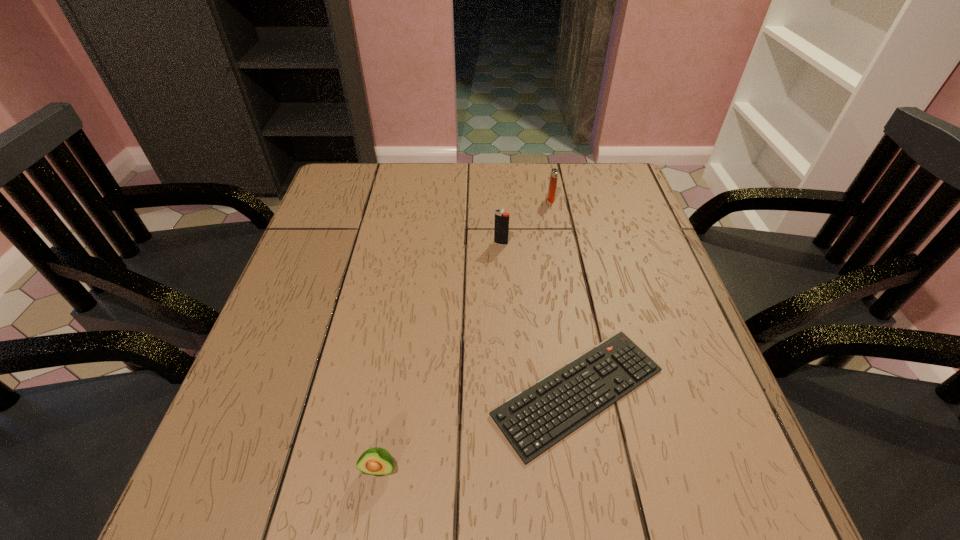
Locate an element on the screen. the nearer igniter is located at coordinates (501, 228).

Where is `the left igniter`? Image resolution: width=960 pixels, height=540 pixels. the left igniter is located at coordinates (501, 228).

This screenshot has width=960, height=540. I want to click on the farther igniter, so [554, 172].

Where is `the right igniter`? Image resolution: width=960 pixels, height=540 pixels. the right igniter is located at coordinates (554, 172).

Identify the location of the second shortest object. (376, 461).

You are a GUI agent. You are given a task and a screenshot of the screen. Output one action in this format:
    pyautogui.click(x=<x>, y=<y>)
    Task: Click on the leftmost object
    The width and height of the screenshot is (960, 540).
    Given the screenshot: What is the action you would take?
    pyautogui.click(x=376, y=461)

Where is `the shortest object`? The width and height of the screenshot is (960, 540). the shortest object is located at coordinates (533, 421).

Image resolution: width=960 pixels, height=540 pixels. What are the coordinates of `vacant space located 0.180m on the left of the left igniter` in the screenshot? It's located at (423, 243).

Locate an element on the screen. vacant space located 0.170m on the right of the farther igniter is located at coordinates (613, 199).

Locate an element on the screen. The image size is (960, 540). free spot located on the cut side of the leftmost object is located at coordinates (371, 522).